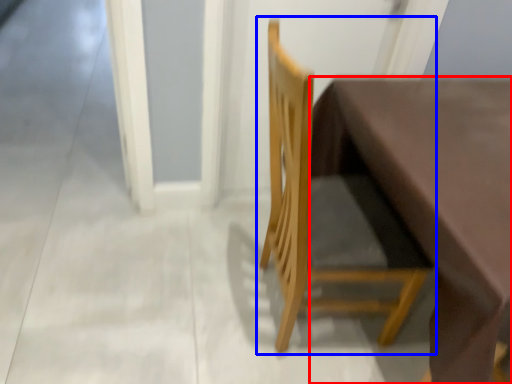
Question: Which object appears closest to the camera in this image, table (highlighted by a red box) or chair (highlighted by a blue box)?

Choices:
 (A) table
 (B) chair

Answer: (A)